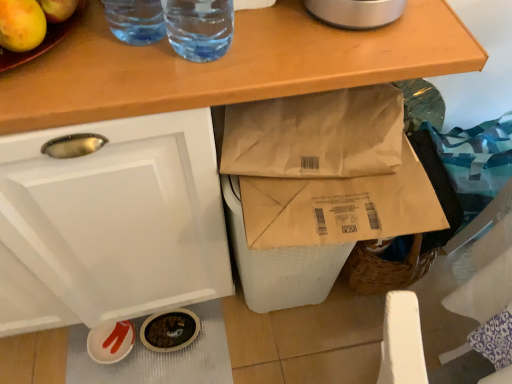
Question: Is the depth of transparent plastic straw at upper center, the first drinking straw in the left-to-right sequence, greater than that of transparent plastic straw at upper center, marked as the 1th drinking straw in a right-to-left arrangement?

Choices:
 (A) yes
 (B) no

Answer: (A)

Question: Does transparent plastic straw at upper center, positioned as the second drinking straw in right-to-left order, have a lesser width compared to transparent plastic straw at upper center, which is the 2th drinking straw from left to right?

Choices:
 (A) yes
 (B) no

Answer: (A)

Question: From the image's perspective, does transparent plastic straw at upper center, positioned as the second drinking straw in right-to-left order, appear lower than transparent plastic straw at upper center, which is the 2th drinking straw from left to right?

Choices:
 (A) no
 (B) yes

Answer: (A)

Question: Does transparent plastic straw at upper center, positioned as the second drinking straw in right-to-left order, have a greater width compared to transparent plastic straw at upper center, which is the 2th drinking straw from left to right?

Choices:
 (A) yes
 (B) no

Answer: (B)

Question: Considering the relative sizes of transparent plastic straw at upper center, positioned as the second drinking straw in right-to-left order, and transparent plastic straw at upper center, which is the 2th drinking straw from left to right, in the image provided, is transparent plastic straw at upper center, positioned as the second drinking straw in right-to-left order, shorter than transparent plastic straw at upper center, which is the 2th drinking straw from left to right,?

Choices:
 (A) yes
 (B) no

Answer: (B)

Question: Is transparent plastic straw at upper center, positioned as the second drinking straw in right-to-left order, far from transparent plastic straw at upper center, marked as the 1th drinking straw in a right-to-left arrangement?

Choices:
 (A) no
 (B) yes

Answer: (A)

Question: Is transparent plastic straw at upper center, which is the 2th drinking straw from left to right, further to camera compared to transparent plastic straw at upper center, the first drinking straw in the left-to-right sequence?

Choices:
 (A) yes
 (B) no

Answer: (B)

Question: Can you confirm if transparent plastic straw at upper center, marked as the 1th drinking straw in a right-to-left arrangement, is positioned to the left of transparent plastic straw at upper center, the first drinking straw in the left-to-right sequence?

Choices:
 (A) yes
 (B) no

Answer: (B)

Question: From the image's perspective, is transparent plastic straw at upper center, which is the 2th drinking straw from left to right, located beneath transparent plastic straw at upper center, positioned as the second drinking straw in right-to-left order?

Choices:
 (A) no
 (B) yes

Answer: (B)

Question: Are transparent plastic straw at upper center, marked as the 1th drinking straw in a right-to-left arrangement, and transparent plastic straw at upper center, the first drinking straw in the left-to-right sequence, far apart?

Choices:
 (A) no
 (B) yes

Answer: (A)

Question: Can you confirm if transparent plastic straw at upper center, which is the 2th drinking straw from left to right, is bigger than transparent plastic straw at upper center, the first drinking straw in the left-to-right sequence?

Choices:
 (A) no
 (B) yes

Answer: (B)

Question: Is transparent plastic straw at upper center, marked as the 1th drinking straw in a right-to-left arrangement, shorter than transparent plastic straw at upper center, the first drinking straw in the left-to-right sequence?

Choices:
 (A) no
 (B) yes

Answer: (A)

Question: In terms of height, does transparent plastic straw at upper center, positioned as the second drinking straw in right-to-left order, look taller or shorter compared to transparent plastic straw at upper center, which is the 2th drinking straw from left to right?

Choices:
 (A) tall
 (B) short

Answer: (B)